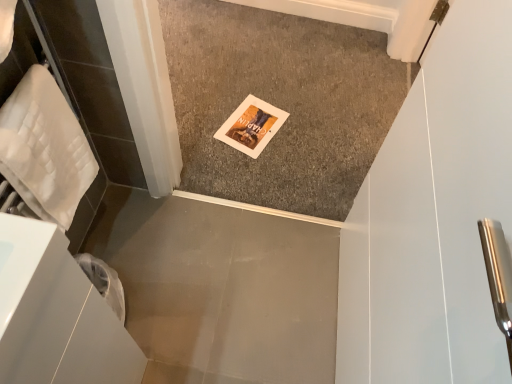
The image size is (512, 384). What do you see at coordinates (221, 289) in the screenshot?
I see `smooth gray concrete at lower left, the 1th concrete ordered from the bottom` at bounding box center [221, 289].

The height and width of the screenshot is (384, 512). I want to click on white quilted towel at left, so click(45, 148).

Which of these two, carpeted floor at center, which ranks as the 2th concrete in bottom-to-top order, or smooth gray concrete at lower left, arranged as the 2th concrete when viewed from the top, is smaller?

smooth gray concrete at lower left, arranged as the 2th concrete when viewed from the top, is smaller.

From the picture: Are carpeted floor at center, which ranks as the 2th concrete in bottom-to-top order, and smooth gray concrete at lower left, which is the first concrete from front to back, beside each other?

carpeted floor at center, which ranks as the 2th concrete in bottom-to-top order, and smooth gray concrete at lower left, which is the first concrete from front to back, are not in contact.

From a real-world perspective, relative to smooth gray concrete at lower left, marked as the second concrete in a back-to-front arrangement, is carpeted floor at center, the 1th concrete from the top, vertically above or below?

From a real-world perspective, carpeted floor at center, the 1th concrete from the top, is physically above smooth gray concrete at lower left, marked as the second concrete in a back-to-front arrangement.

Considering the relative positions of carpeted floor at center, which ranks as the 2th concrete in bottom-to-top order, and smooth gray concrete at lower left, arranged as the 2th concrete when viewed from the top, in the image provided, is carpeted floor at center, which ranks as the 2th concrete in bottom-to-top order, to the left of smooth gray concrete at lower left, arranged as the 2th concrete when viewed from the top, from the viewer's perspective?

Incorrect, carpeted floor at center, which ranks as the 2th concrete in bottom-to-top order, is not on the left side of smooth gray concrete at lower left, arranged as the 2th concrete when viewed from the top.

From the image's perspective, between carpeted floor at center, which ranks as the 2th concrete in bottom-to-top order, and white quilted towel at left, who is located below?

white quilted towel at left.

Is white quilted towel at left at the back of carpeted floor at center, positioned as the first concrete in back-to-front order?

No, white quilted towel at left is not at the back of carpeted floor at center, positioned as the first concrete in back-to-front order.

From a real-world perspective, who is located higher, carpeted floor at center, which is the 2th concrete from front to back, or white quilted towel at left?

white quilted towel at left.

In terms of height, does carpeted floor at center, the 1th concrete from the top, look taller or shorter compared to white quilted towel at left?

carpeted floor at center, the 1th concrete from the top, is shorter than white quilted towel at left.

Looking at this image, considering the positions of objects white quilted towel at left and smooth gray concrete at lower left, arranged as the 2th concrete when viewed from the top, in the image provided, who is in front, white quilted towel at left or smooth gray concrete at lower left, arranged as the 2th concrete when viewed from the top,?

Positioned in front is white quilted towel at left.

Is smooth gray concrete at lower left, which is the first concrete from front to back, at the back of white quilted towel at left?

That's not correct — white quilted towel at left is not looking away from smooth gray concrete at lower left, which is the first concrete from front to back.

Who is taller, white quilted towel at left or smooth gray concrete at lower left, the 1th concrete ordered from the bottom?

Standing taller between the two is white quilted towel at left.

Considering the relative sizes of white quilted towel at left and smooth gray concrete at lower left, the 1th concrete ordered from the bottom, in the image provided, is white quilted towel at left bigger than smooth gray concrete at lower left, the 1th concrete ordered from the bottom,?

No.

Is point (181, 284) less distant than point (49, 79)?

No, (181, 284) is further to viewer.

Can you confirm if smooth gray concrete at lower left, marked as the second concrete in a back-to-front arrangement, is thinner than white quilted towel at left?

Incorrect, the width of smooth gray concrete at lower left, marked as the second concrete in a back-to-front arrangement, is not less than that of white quilted towel at left.

From a real-world perspective, starting from the white quilted towel at left, which concrete is the 2nd one below it? Please provide its 2D coordinates.

[(221, 289)]

What's the angular difference between smooth gray concrete at lower left, arranged as the 2th concrete when viewed from the top, and white quilted towel at left's facing directions?

smooth gray concrete at lower left, arranged as the 2th concrete when viewed from the top, and white quilted towel at left are facing 88.8 degrees away from each other.

From a real-world perspective, does smooth gray concrete at lower left, which is the first concrete from front to back, stand above carpeted floor at center, which ranks as the 2th concrete in bottom-to-top order?

No, from a real-world perspective, smooth gray concrete at lower left, which is the first concrete from front to back, is not over carpeted floor at center, which ranks as the 2th concrete in bottom-to-top order

Which object is thinner, smooth gray concrete at lower left, arranged as the 2th concrete when viewed from the top, or carpeted floor at center, which ranks as the 2th concrete in bottom-to-top order?

smooth gray concrete at lower left, arranged as the 2th concrete when viewed from the top, is thinner.

Considering the relative sizes of smooth gray concrete at lower left, which is the first concrete from front to back, and carpeted floor at center, which ranks as the 2th concrete in bottom-to-top order, in the image provided, is smooth gray concrete at lower left, which is the first concrete from front to back, bigger than carpeted floor at center, which ranks as the 2th concrete in bottom-to-top order,?

No.

The width and height of the screenshot is (512, 384). Find the location of `material lying in front of the carpeted floor at center, which ranks as the 2th concrete in bottom-to-top order`. material lying in front of the carpeted floor at center, which ranks as the 2th concrete in bottom-to-top order is located at coordinates (45, 148).

How many degrees apart are the facing directions of white quilted towel at left and carpeted floor at center, which is the 2th concrete from front to back?

They differ by 91.5 degrees in their facing directions.

Which of these two, white quilted towel at left or carpeted floor at center, the 1th concrete from the top, is wider?

Wider between the two is carpeted floor at center, the 1th concrete from the top.

Between white quilted towel at left and carpeted floor at center, which is the 2th concrete from front to back, which one has smaller size?

white quilted towel at left.

Find the location of a particular element. concrete on the right side of smooth gray concrete at lower left, marked as the second concrete in a back-to-front arrangement is located at coordinates (280, 102).

At what (x,y) coordinates should I click in order to perform the action: click on material located on the left of carpeted floor at center, the 1th concrete from the top. Please return your answer as a coordinate pair (x, y). This screenshot has width=512, height=384. Looking at the image, I should click on (45, 148).

Estimate the real-world distances between objects in this image. Which object is closer to carpeted floor at center, the 1th concrete from the top, white quilted towel at left or smooth gray concrete at lower left, which is the first concrete from front to back?

smooth gray concrete at lower left, which is the first concrete from front to back.

From the image, which object appears to be farther from smooth gray concrete at lower left, which is the first concrete from front to back, white quilted towel at left or carpeted floor at center, the 1th concrete from the top?

white quilted towel at left.

Based on their spatial positions, is carpeted floor at center, which is the 2th concrete from front to back, or white quilted towel at left closer to smooth gray concrete at lower left, arranged as the 2th concrete when viewed from the top?

Among the two, carpeted floor at center, which is the 2th concrete from front to back, is located nearer to smooth gray concrete at lower left, arranged as the 2th concrete when viewed from the top.

Based on their spatial positions, is smooth gray concrete at lower left, which is the first concrete from front to back, or carpeted floor at center, the 1th concrete from the top, closer to white quilted towel at left?

Based on the image, smooth gray concrete at lower left, which is the first concrete from front to back, appears to be nearer to white quilted towel at left.

Which object lies further to the anchor point carpeted floor at center, positioned as the first concrete in back-to-front order, smooth gray concrete at lower left, marked as the second concrete in a back-to-front arrangement, or white quilted towel at left?

white quilted towel at left is further to carpeted floor at center, positioned as the first concrete in back-to-front order.

In the scene shown: Estimate the real-world distances between objects in this image. Which object is closer to white quilted towel at left, carpeted floor at center, the 1th concrete from the top, or smooth gray concrete at lower left, arranged as the 2th concrete when viewed from the top?

smooth gray concrete at lower left, arranged as the 2th concrete when viewed from the top, is closer to white quilted towel at left.

Image resolution: width=512 pixels, height=384 pixels. In order to click on material between carpeted floor at center, positioned as the first concrete in back-to-front order, and smooth gray concrete at lower left, which is the first concrete from front to back, in the up-down direction in this screenshot , I will do `click(45, 148)`.